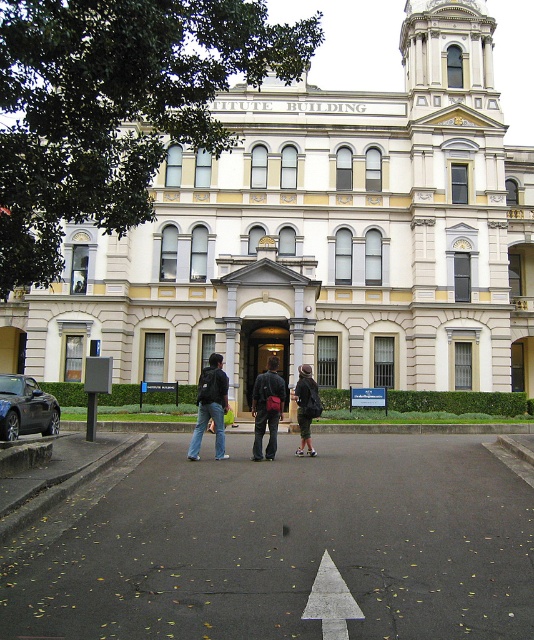
Question: Which object appears farthest from the camera in this image?

Choices:
 (A) jeans at center
 (B) dark blue jeans at center

Answer: (A)

Question: Which object is closer to the camera taking this photo?

Choices:
 (A) black asphalt pavement at center
 (B) jeans at center

Answer: (A)

Question: Does jeans at center come in front of dark gray fabric jacket at center?

Choices:
 (A) yes
 (B) no

Answer: (A)

Question: Is matte black backpack at center bigger than dark gray fabric jacket at center?

Choices:
 (A) yes
 (B) no

Answer: (A)

Question: Does shiny black car at left have a larger size compared to jeans at center?

Choices:
 (A) no
 (B) yes

Answer: (A)

Question: Which object appears closest to the camera in this image?

Choices:
 (A) shiny black car at left
 (B) black asphalt pavement at center
 (C) dark gray fabric jacket at center

Answer: (B)